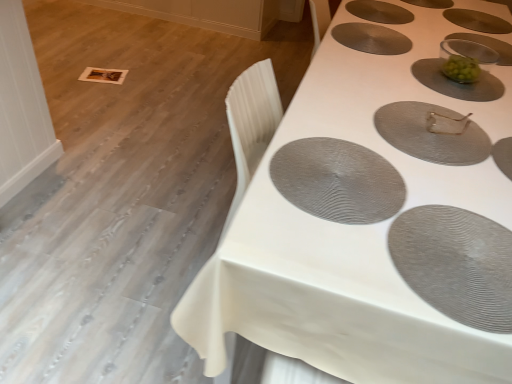
Identify the location of vacant space behind matte gray placemat at center, which is the fifth oval in back-to-front order. (395, 81).